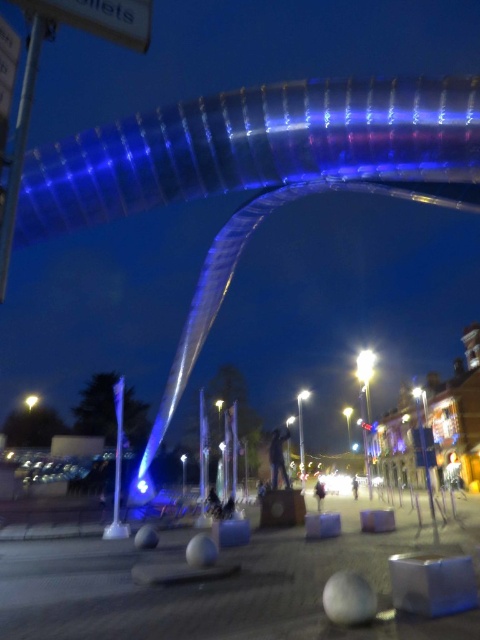
Between point (129, 4) and point (26, 406), which one is positioned behind?

Positioned behind is point (26, 406).

Which is above, white plastic sign at upper left or yellow glass light at center?

Positioned higher is white plastic sign at upper left.

Is point (46, 3) behind point (24, 401)?

No, (46, 3) is in front of (24, 401).

Image resolution: width=480 pixels, height=640 pixels. I want to click on white plastic sign at upper left, so click(x=98, y=17).

Between point (118, 410) and point (365, 438), which one is positioned behind?

The point (365, 438) is behind.

Between white glossy pole at center and metallic pole at center, which one has more height?

Standing taller between the two is metallic pole at center.

Does point (116, 525) come farther from viewer compared to point (367, 483)?

That is False.

Where is `white glossy pole at center`? white glossy pole at center is located at coordinates [x=118, y=468].

Between white plastic sign at upper left and white glossy streetlight at center, which one appears on the left side from the viewer's perspective?

white plastic sign at upper left

Does point (85, 24) lie behind point (365, 381)?

No.

Where is `white plastic sign at upper left`? The image size is (480, 640). white plastic sign at upper left is located at coordinates (98, 17).